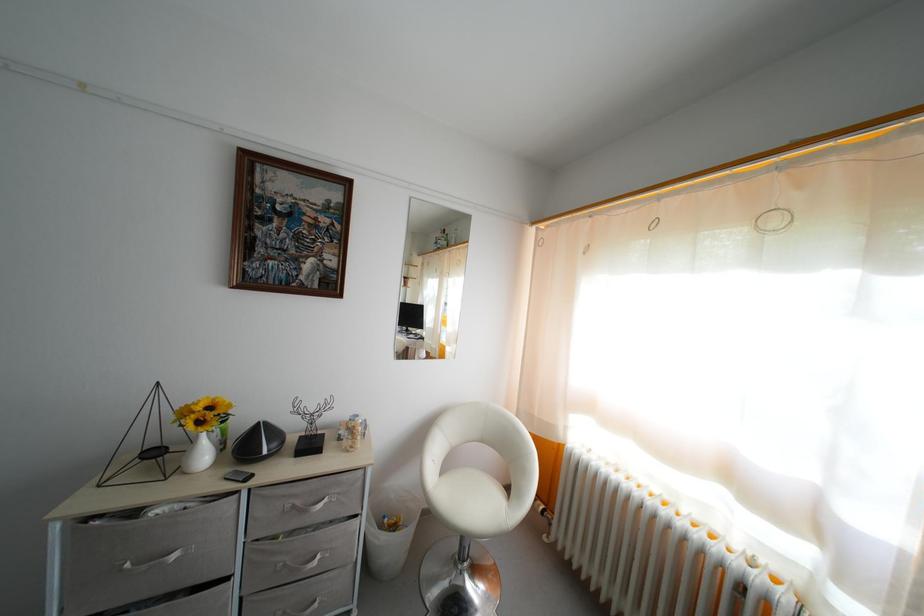
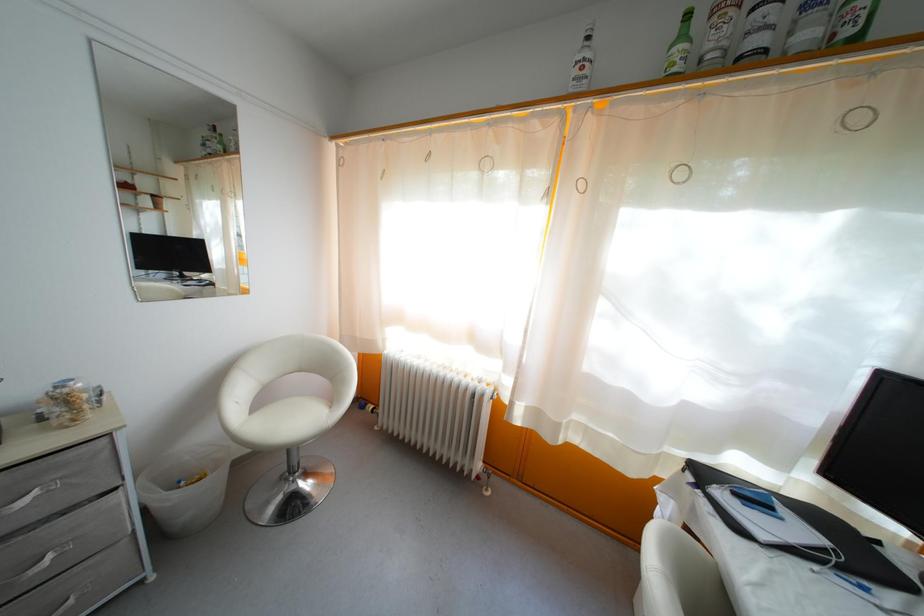
Where in the second image is the point corresponding to (x=454, y=472) from the first image?

(265, 408)